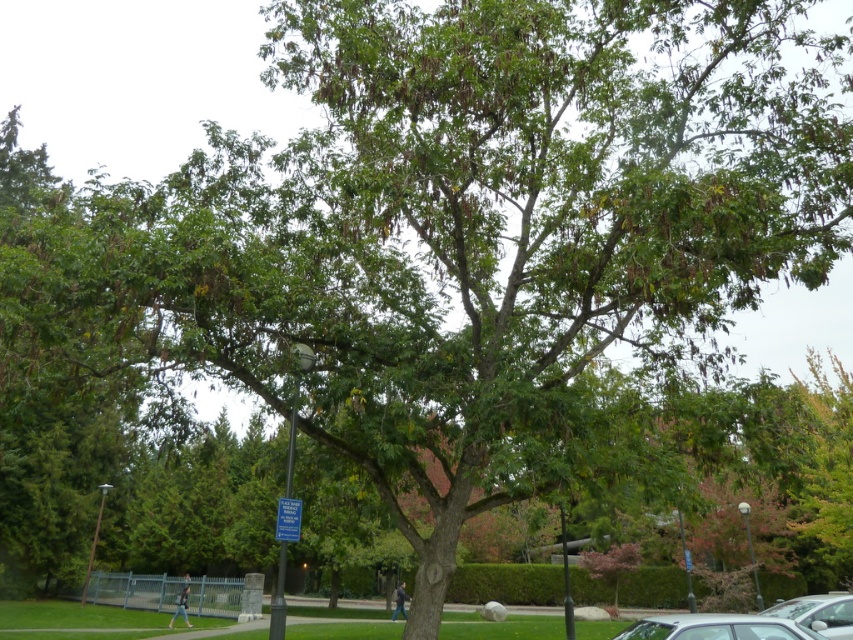
Does point (706, 636) lie behind point (842, 605)?

No, (706, 636) is in front of (842, 605).

Does point (750, 616) lie in front of point (848, 618)?

Yes, point (750, 616) is closer to viewer.

Image resolution: width=853 pixels, height=640 pixels. What are the coordinates of `silver metallic car at lower center` in the screenshot? It's located at (717, 627).